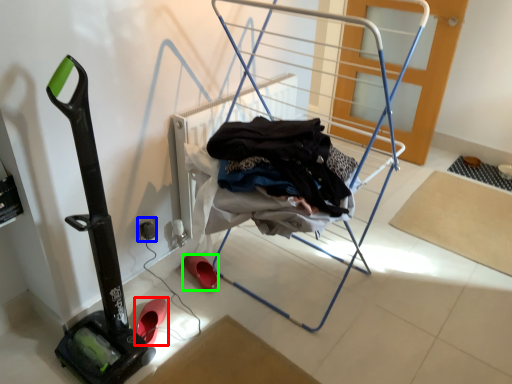
Question: Which is farther away from footwear (highlighted by a red box)? electric outlet (highlighted by a blue box) or footwear (highlighted by a green box)?

Choices:
 (A) electric outlet
 (B) footwear

Answer: (A)